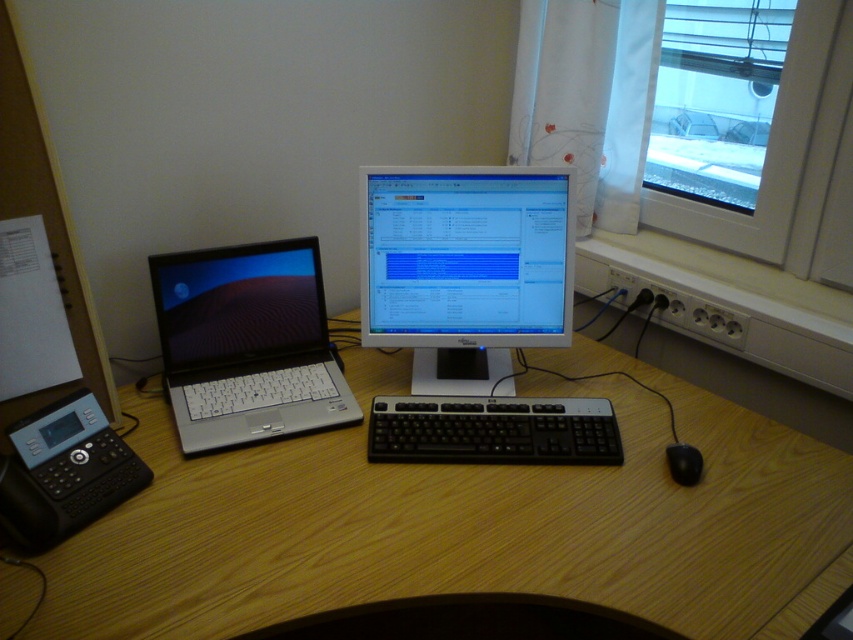
Which is behind, point (743, 513) or point (692, 464)?

The point (692, 464) is behind.

Who is lower down, wooden at center or black rubber mouse at lower right?

black rubber mouse at lower right

Locate an element on the screen. This screenshot has width=853, height=640. wooden at center is located at coordinates (469, 524).

Between silver metallic laptop at left and black rubber mouse at lower right, which one has more height?

With more height is silver metallic laptop at left.

Does silver metallic laptop at left lie in front of black rubber mouse at lower right?

No, silver metallic laptop at left is behind black rubber mouse at lower right.

Between point (259, 433) and point (689, 465), which one is positioned in front?

Point (689, 465) is in front.

Find the location of a particular element. The height and width of the screenshot is (640, 853). silver metallic laptop at left is located at coordinates (247, 344).

Between matte black monitor at center and transparent glass window at upper right, which one appears on the left side from the viewer's perspective?

matte black monitor at center

Does point (415, 198) come behind point (730, 234)?

No.

Locate an element on the screen. This screenshot has width=853, height=640. matte black monitor at center is located at coordinates (465, 269).